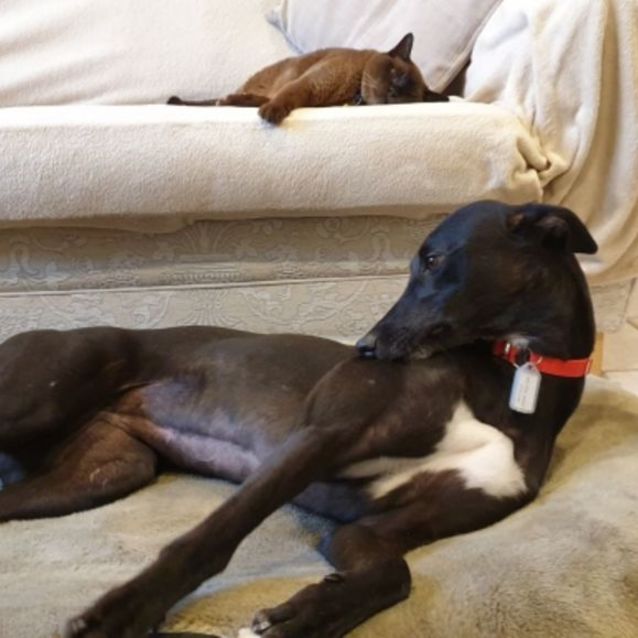
The height and width of the screenshot is (638, 638). I want to click on white fur, so click(453, 448), click(224, 445).